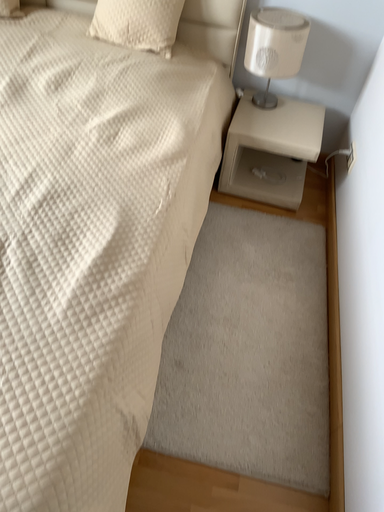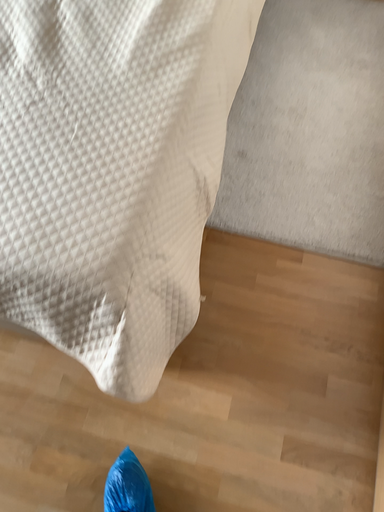
Question: How did the camera likely rotate when shooting the video?

Choices:
 (A) rotated upward
 (B) rotated downward

Answer: (B)